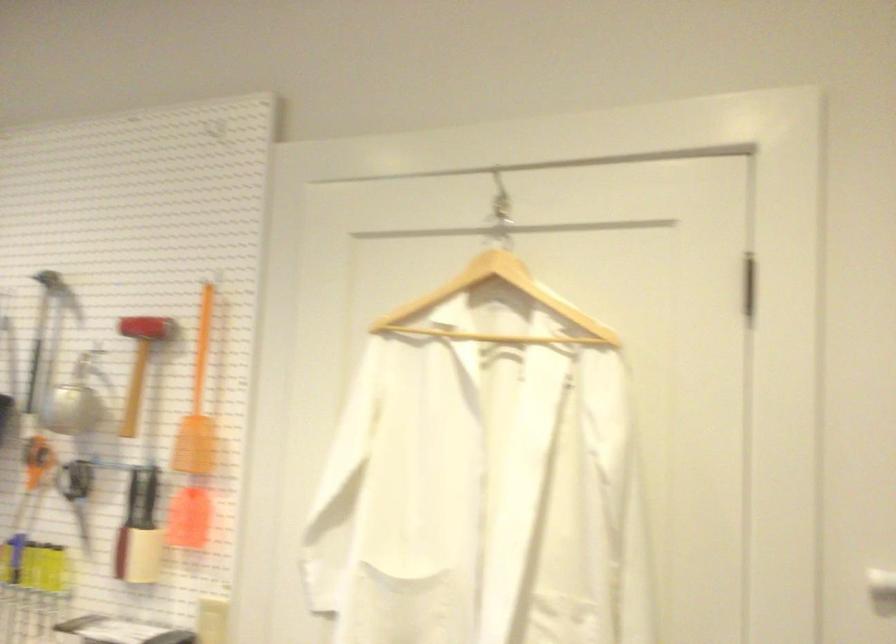
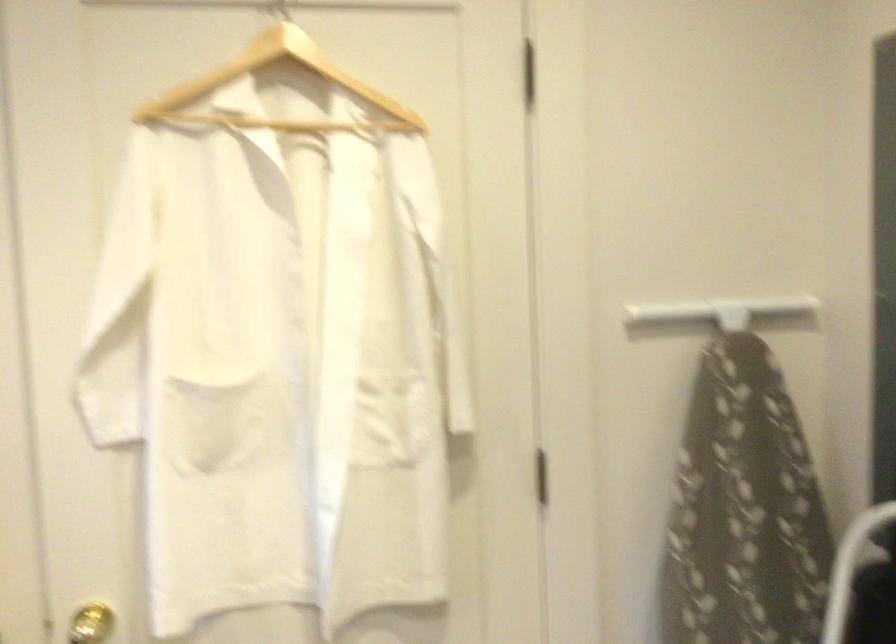
Find the pixel in the second image that matches [488,307] in the first image.

(277, 90)